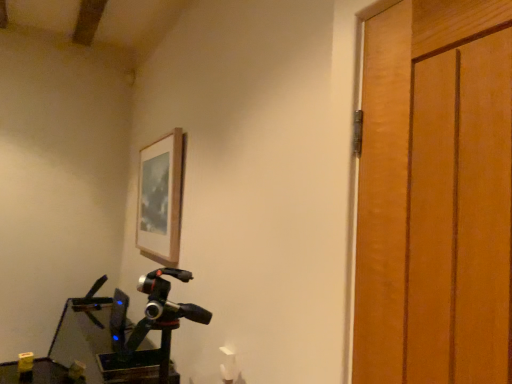
What do you see at coordinates (160, 197) in the screenshot?
I see `wooden picture frame at upper center` at bounding box center [160, 197].

The width and height of the screenshot is (512, 384). I want to click on wooden picture frame at upper center, so click(160, 197).

Measure the distance between metallic green workbench at lower left and camera.

The distance of metallic green workbench at lower left from camera is 2.46 meters.

The image size is (512, 384). I want to click on metallic green workbench at lower left, so click(89, 347).

The height and width of the screenshot is (384, 512). What do you see at coordinates (89, 347) in the screenshot? I see `metallic green workbench at lower left` at bounding box center [89, 347].

Find the location of a particular element. The width and height of the screenshot is (512, 384). wooden picture frame at upper center is located at coordinates (160, 197).

Considering the relative positions of metallic green workbench at lower left and wooden picture frame at upper center in the image provided, is metallic green workbench at lower left to the left or to the right of wooden picture frame at upper center?

Based on their positions, metallic green workbench at lower left is located to the left of wooden picture frame at upper center.

Which object is closer to the camera, metallic green workbench at lower left or wooden picture frame at upper center?

Positioned in front is metallic green workbench at lower left.

Considering the positions of point (65, 327) and point (149, 249), is point (65, 327) closer or farther from the camera than point (149, 249)?

Point (65, 327) is positioned farther from the camera compared to point (149, 249).

From the image's perspective, which is above, metallic green workbench at lower left or wooden picture frame at upper center?

wooden picture frame at upper center appears higher in the image.

From a real-world perspective, is metallic green workbench at lower left positioned above or below wooden picture frame at upper center?

In terms of real-world spatial position, metallic green workbench at lower left is below wooden picture frame at upper center.

Considering the sizes of objects metallic green workbench at lower left and wooden picture frame at upper center in the image provided, who is thinner, metallic green workbench at lower left or wooden picture frame at upper center?

With smaller width is wooden picture frame at upper center.

Considering the sizes of metallic green workbench at lower left and wooden picture frame at upper center in the image, is metallic green workbench at lower left taller or shorter than wooden picture frame at upper center?

In the image, metallic green workbench at lower left appears to be taller than wooden picture frame at upper center.

Can you confirm if metallic green workbench at lower left is bigger than wooden picture frame at upper center?

Correct, metallic green workbench at lower left is larger in size than wooden picture frame at upper center.

Would you say metallic green workbench at lower left contains wooden picture frame at upper center?

No, wooden picture frame at upper center is located outside of metallic green workbench at lower left.

Is metallic green workbench at lower left far from wooden picture frame at upper center?

metallic green workbench at lower left is near wooden picture frame at upper center, not far away.

Is metallic green workbench at lower left facing towards wooden picture frame at upper center?

No, metallic green workbench at lower left is not aimed at wooden picture frame at upper center.

How many degrees apart are the facing directions of metallic green workbench at lower left and wooden picture frame at upper center?

The facing directions of metallic green workbench at lower left and wooden picture frame at upper center are 1.95 degrees apart.

Measure the distance from metallic green workbench at lower left to wooden picture frame at upper center.

They are 89.33 centimeters apart.

Locate an element on the screen. The width and height of the screenshot is (512, 384). workbench that is below the wooden picture frame at upper center (from the image's perspective) is located at coordinates (89, 347).

Considering the positions of objects wooden picture frame at upper center and metallic green workbench at lower left in the image provided, who is more to the left, wooden picture frame at upper center or metallic green workbench at lower left?

Positioned to the left is metallic green workbench at lower left.

Consider the image. Is wooden picture frame at upper center in front of or behind metallic green workbench at lower left in the image?

In the image, wooden picture frame at upper center appears behind metallic green workbench at lower left.

Does point (157, 241) appear closer or farther from the camera than point (96, 346)?

Point (157, 241).

From the image's perspective, is wooden picture frame at upper center located above or below metallic green workbench at lower left?

wooden picture frame at upper center is above metallic green workbench at lower left.

In the scene shown: From a real-world perspective, is wooden picture frame at upper center above or below metallic green workbench at lower left?

wooden picture frame at upper center is situated higher than metallic green workbench at lower left in the real world.

Considering the relative sizes of wooden picture frame at upper center and metallic green workbench at lower left in the image provided, is wooden picture frame at upper center thinner than metallic green workbench at lower left?

Yes, wooden picture frame at upper center is thinner than metallic green workbench at lower left.

Considering the relative sizes of wooden picture frame at upper center and metallic green workbench at lower left in the image provided, is wooden picture frame at upper center shorter than metallic green workbench at lower left?

Indeed, wooden picture frame at upper center has a lesser height compared to metallic green workbench at lower left.

Who is bigger, wooden picture frame at upper center or metallic green workbench at lower left?

metallic green workbench at lower left is bigger.

Could metallic green workbench at lower left be considered to be inside wooden picture frame at upper center?

Definitely not — metallic green workbench at lower left is not inside wooden picture frame at upper center.

Is wooden picture frame at upper center beside metallic green workbench at lower left?

wooden picture frame at upper center and metallic green workbench at lower left are not in contact.

Is wooden picture frame at upper center facing towards metallic green workbench at lower left?

No.

Can you tell me how much wooden picture frame at upper center and metallic green workbench at lower left differ in facing direction?

1.95 degrees.

How distant is wooden picture frame at upper center from metallic green workbench at lower left?

35.17 inches.

The width and height of the screenshot is (512, 384). I want to click on picture frame lying on the right of metallic green workbench at lower left, so [160, 197].

In the image, there is a wooden picture frame at upper center. Identify the location of workbench below it (from a real-world perspective). (89, 347).

Where is `picture frame above the metallic green workbench at lower left (from a real-world perspective)`? The height and width of the screenshot is (384, 512). picture frame above the metallic green workbench at lower left (from a real-world perspective) is located at coordinates (160, 197).